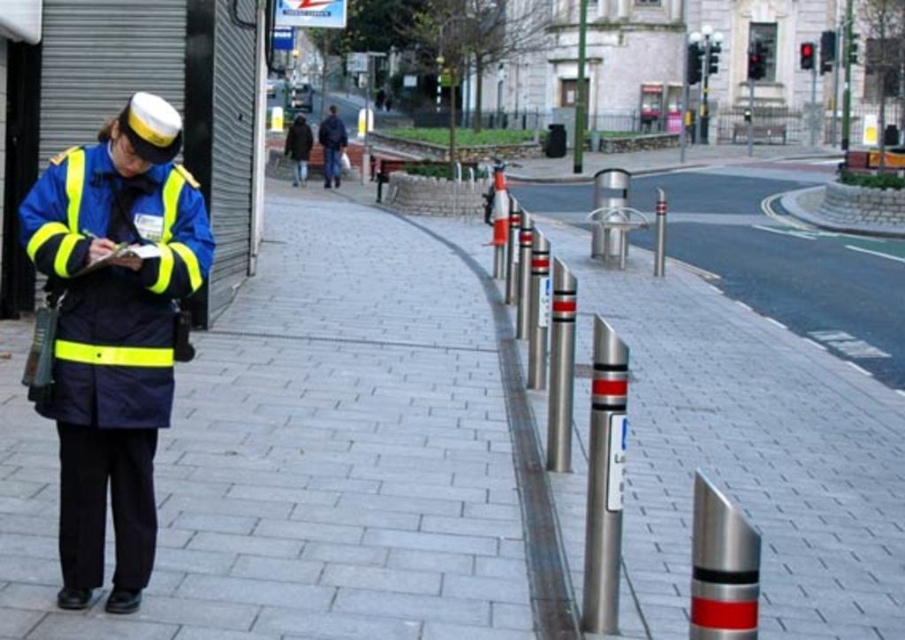
Question: Is silver metallic pole at center to the right of dark blue jacket at center from the viewer's perspective?

Choices:
 (A) no
 (B) yes

Answer: (B)

Question: Which point is closer to the camera?

Choices:
 (A) gray brick pavement at left
 (B) dark blue jacket at center
 (C) high-visibility fabric uniform at left

Answer: (C)

Question: Considering the real-world distances, which object is closest to the high-visibility fabric uniform at left?

Choices:
 (A) polished metal pole at upper right
 (B) dark brown leather jacket at center
 (C) polished metallic pole at center-right
 (D) silver metallic pole at center

Answer: (C)

Question: Which is nearer to the high-visibility fabric uniform at left?

Choices:
 (A) polished metal pole at upper right
 (B) polished metallic pole at center-right
 (C) dark blue jacket at center
 (D) dark brown leather jacket at center

Answer: (B)

Question: Does polished metallic pole at center-right appear over dark brown leather jacket at center?

Choices:
 (A) no
 (B) yes

Answer: (A)

Question: Is silver metallic pole at center positioned in front of polished metal pole at upper right?

Choices:
 (A) yes
 (B) no

Answer: (A)